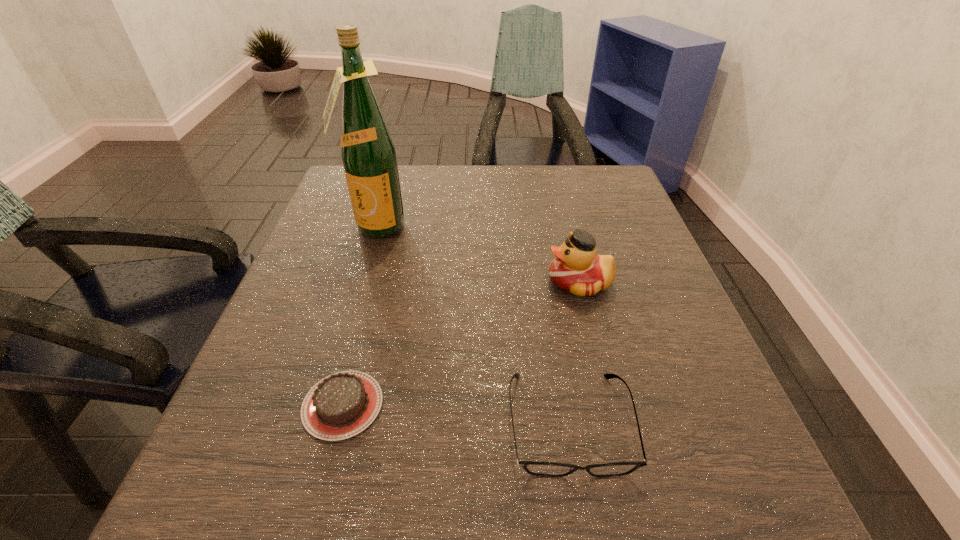
Where is `free space between the second farthest object and the third tallest object`? The width and height of the screenshot is (960, 540). free space between the second farthest object and the third tallest object is located at coordinates point(574,353).

Find the location of a particular element. The width and height of the screenshot is (960, 540). free area in between the second shortest object and the liquor is located at coordinates (472, 325).

Locate an element on the screen. The height and width of the screenshot is (540, 960). free spot between the liquor and the chocolate cake is located at coordinates pos(359,316).

Locate an element on the screen. The image size is (960, 540). free point between the duck and the chocolate cake is located at coordinates (461, 343).

Where is `unoccupied position between the chocolate cake and the farthest object`? unoccupied position between the chocolate cake and the farthest object is located at coordinates (359, 316).

Find the location of a particular element. free space between the third shortest object and the chocolate cake is located at coordinates (461, 343).

Locate which object is the second closest to the second shortest object. Please provide its 2D coordinates. Your answer should be formatted as a tuple, i.e. [(x, y)], where the tuple contains the x and y coordinates of a point satisfying the conditions above.

[(341, 405)]

Identify which object is located as the second nearest to the third shortest object. Please provide its 2D coordinates. Your answer should be formatted as a tuple, i.e. [(x, y)], where the tuple contains the x and y coordinates of a point satisfying the conditions above.

[(368, 154)]

You are a GUI agent. You are given a task and a screenshot of the screen. Output one action in this format:
    pyautogui.click(x=<x>, y=<y>)
    Task: Click on the free space that satisfies the following two spatial constraints: 1. on the face of the duck; 2. on the front-facing side of the third tallest object
    
    Given the screenshot: What is the action you would take?
    pyautogui.click(x=614, y=423)

Identify the location of vacant space that satisfies the following two spatial constraints: 1. on the front-facing side of the shortest object; 2. on the right side of the tallest object. This screenshot has height=540, width=960. (322, 405).